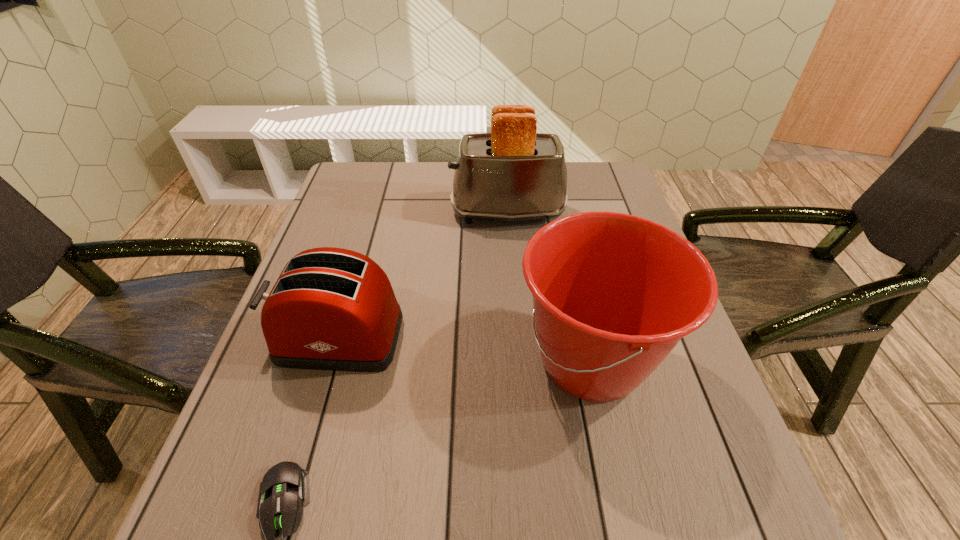
In the image, there is a desktop. Where is `free space at the near right corner`? The height and width of the screenshot is (540, 960). free space at the near right corner is located at coordinates (659, 503).

At what (x,y) coordinates should I click in order to perform the action: click on free area in between the right toaster and the third tallest object. Please return your answer as a coordinate pair (x, y). This screenshot has width=960, height=540. Looking at the image, I should click on (422, 275).

At what (x,y) coordinates should I click in order to perform the action: click on free space between the bucket and the left toaster. Please return your answer as a coordinate pair (x, y). The image size is (960, 540). Looking at the image, I should click on (464, 349).

In order to click on vacant point located between the shorter toaster and the bucket in this screenshot , I will do `click(464, 349)`.

What are the coordinates of `free space between the shorter toaster and the bucket` in the screenshot? It's located at (464, 349).

Identify which object is located as the nearest to the farthest object. Please provide its 2D coordinates. Your answer should be formatted as a tuple, i.e. [(x, y)], where the tuple contains the x and y coordinates of a point satisfying the conditions above.

[(613, 293)]

Select which object appears as the second closest to the bucket. Please provide its 2D coordinates. Your answer should be formatted as a tuple, i.e. [(x, y)], where the tuple contains the x and y coordinates of a point satisfying the conditions above.

[(512, 174)]

Locate an element on the screen. This screenshot has height=540, width=960. free region that satisfies the following two spatial constraints: 1. on the side of the right toaster with the control lever; 2. on the front side of the left toaster is located at coordinates coord(517,338).